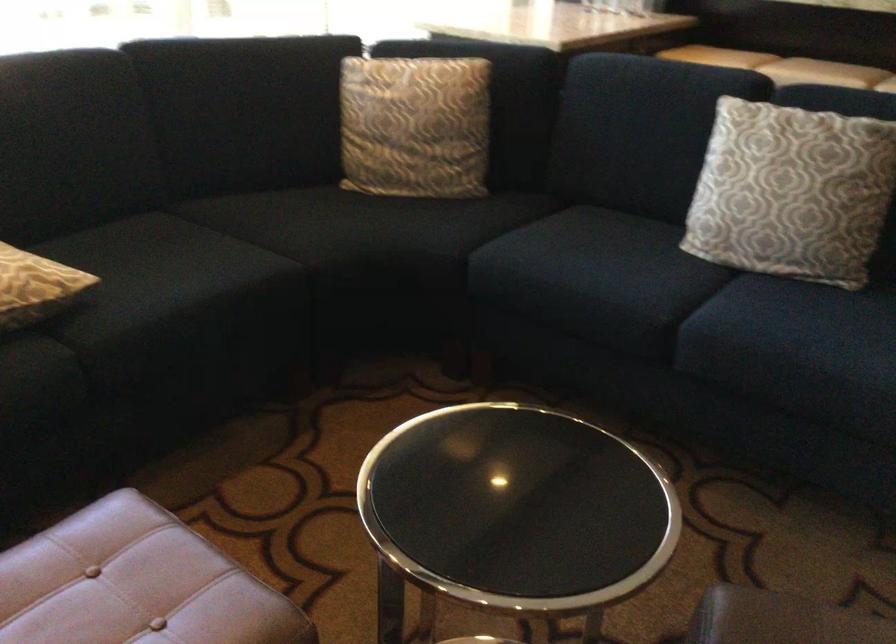
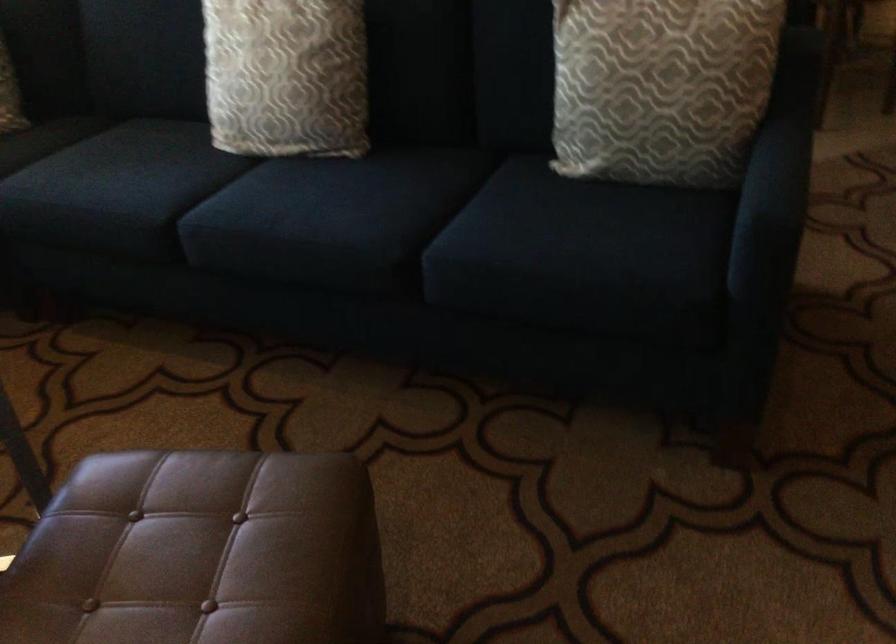
Question: The images are taken continuously from a first-person perspective. In which direction is your viewpoint rotating?

Choices:
 (A) Left
 (B) Right
 (C) Up
 (D) Down

Answer: (B)